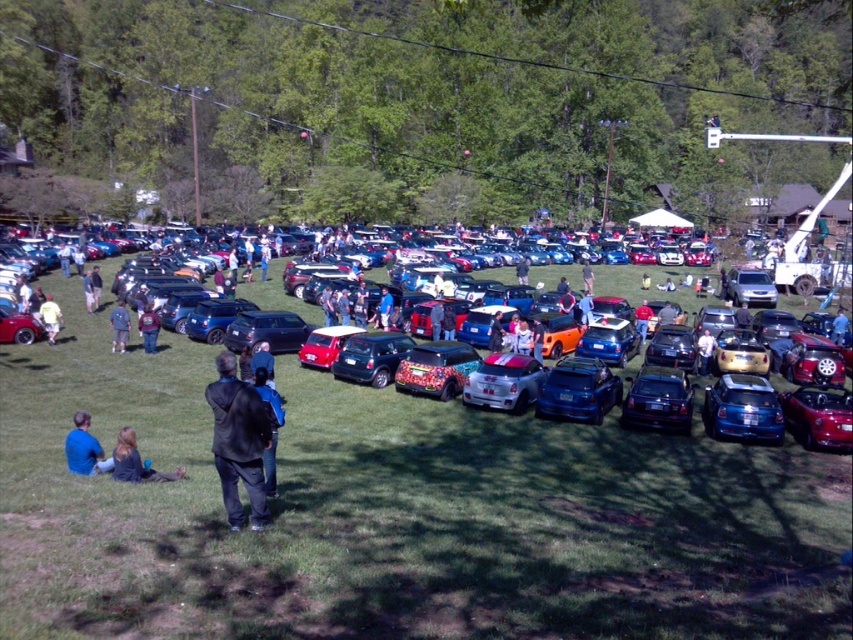
You are standing at the point labeled point [39,314] and want to walk to the point labeled point [430,358]. Based on the scene description, will you have to walk through any parked cars to reach your destination?

Since point [430,358] is in front of point [39,314], you would be moving towards the direction where the parked cars are located. However, the cars are parked closely together in rows, so you would likely have to walk through or around them to reach your destination.

You are a photographer at the car show. You want to take a photo of the glossy black car at center without any people in the frame. Is the denim jacket at lower left currently blocking your shot?

The glossy black car at center is in front of the denim jacket at lower left, so the car is blocking the jacket. Therefore, the denim jacket at lower left is not in front of the car and won not block your shot.